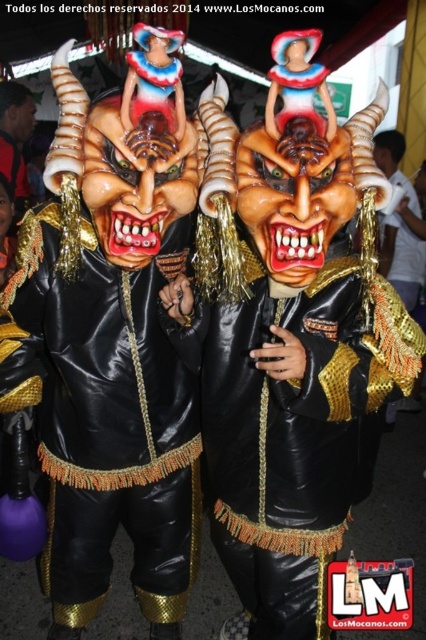
Question: Which of the following is the closest to the observer?

Choices:
 (A) shiny black leather mask at center
 (B) black leather mask at center

Answer: (A)

Question: Does black leather mask at center have a lesser width compared to shiny black leather mask at center?

Choices:
 (A) yes
 (B) no

Answer: (A)

Question: Does black leather mask at center lie in front of shiny black leather mask at center?

Choices:
 (A) no
 (B) yes

Answer: (A)

Question: Does black leather mask at center have a lesser width compared to shiny black leather mask at center?

Choices:
 (A) no
 (B) yes

Answer: (B)